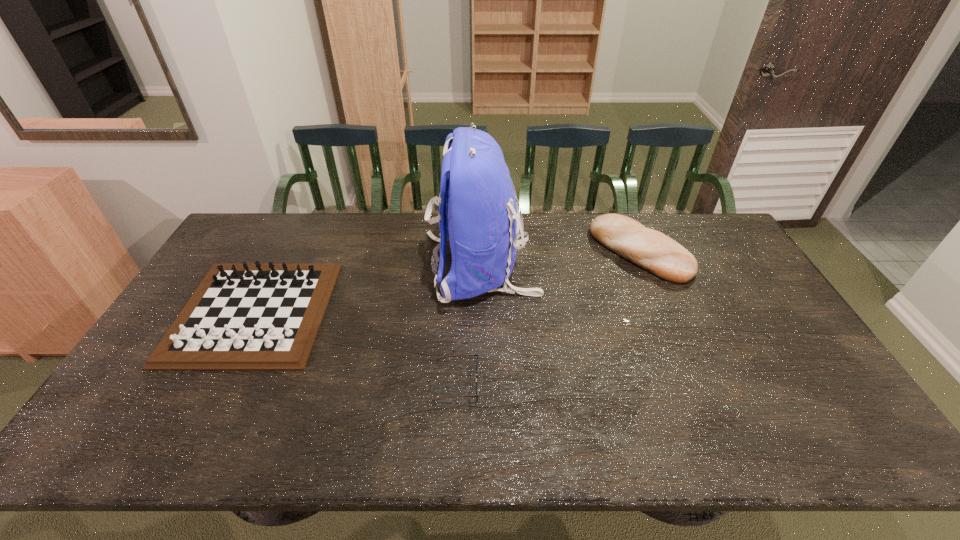
What are the coordinates of `free point between the gameboard and the spectacles` in the screenshot? It's located at (355, 346).

Locate an element on the screen. This screenshot has width=960, height=540. free space between the shortest object and the leftmost object is located at coordinates (355, 346).

Locate an element on the screen. Image resolution: width=960 pixels, height=540 pixels. free space between the rightmost object and the spectacles is located at coordinates (548, 316).

Image resolution: width=960 pixels, height=540 pixels. I want to click on unoccupied area between the bread and the spectacles, so click(x=548, y=316).

Locate an element on the screen. This screenshot has width=960, height=540. empty location between the rightmost object and the spectacles is located at coordinates (548, 316).

Find the location of a particular element. Image resolution: width=960 pixels, height=540 pixels. blank region between the backpack and the bread is located at coordinates (561, 260).

Find the location of a particular element. This screenshot has height=540, width=960. object that stands as the second closest to the leftmost object is located at coordinates (477, 380).

This screenshot has width=960, height=540. Identify the location of the closest object to the shortest object. (477, 205).